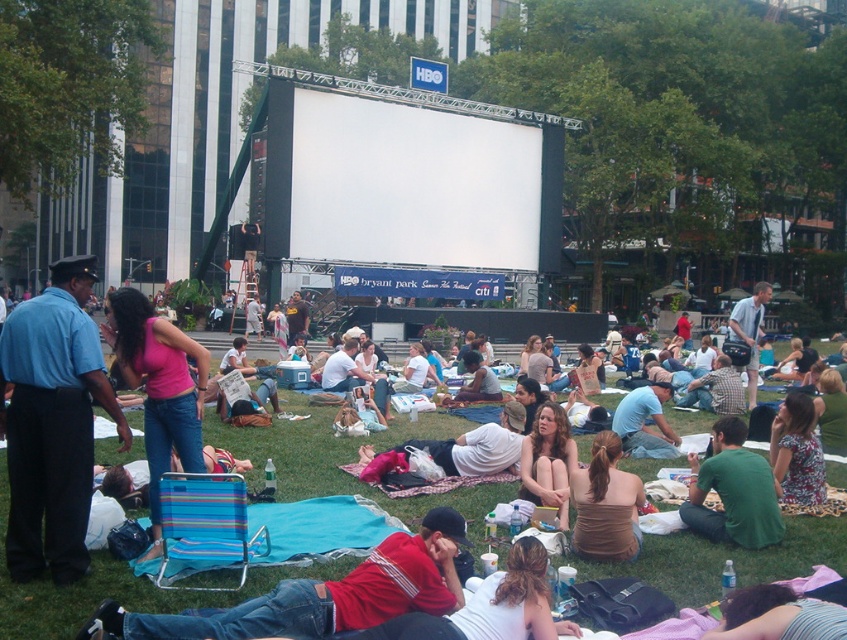
You are standing in the audience area of the Bryant Park movie screening. You notice two points on the stage screen. The first point is labeled as point (759, 488) and the second is point (555, 500). Which point is closer to you?

Point (759, 488) is closer to the viewer than point (555, 500).